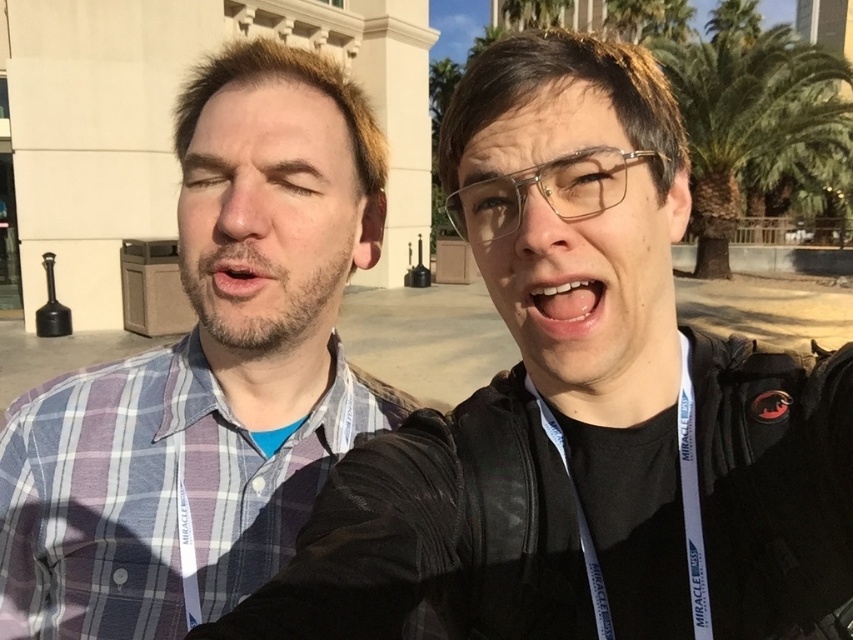
You are a photographer standing 30 inches away from the white glossy teeth at center in the image. Can you fit the entire scene into your camera frame without moving closer or farther?

The distance between you and the white glossy teeth at center is 29.05 inches, which is less than your current position of 30 inches. To capture the entire scene without moving, you might need to adjust your camera angle or zoom out slightly to ensure everything fits within the frame.